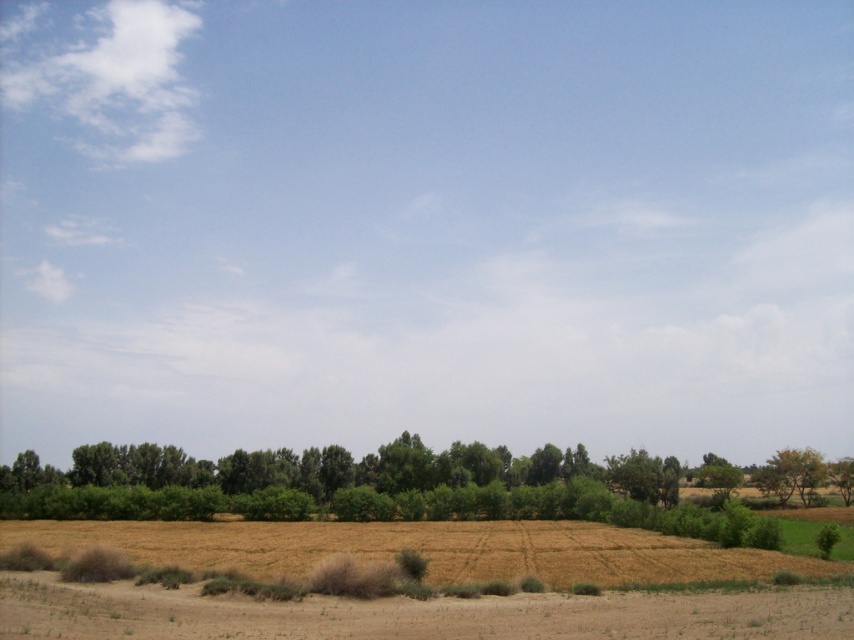
You are a farmer standing in the field and see the green leafy trees at center and the brown dry soil at lower center. Which object is located to the right of the other?

The green leafy trees at center is positioned on the right side of brown dry soil at lower center.

You are a farmer inspecting your field. You notice the green leafy trees at center and the brown dry soil at lower center. Which object occupies a bigger area in the scene?

The green leafy trees at center occupies a bigger area in the scene compared to the brown dry soil at lower center as it has a larger size.